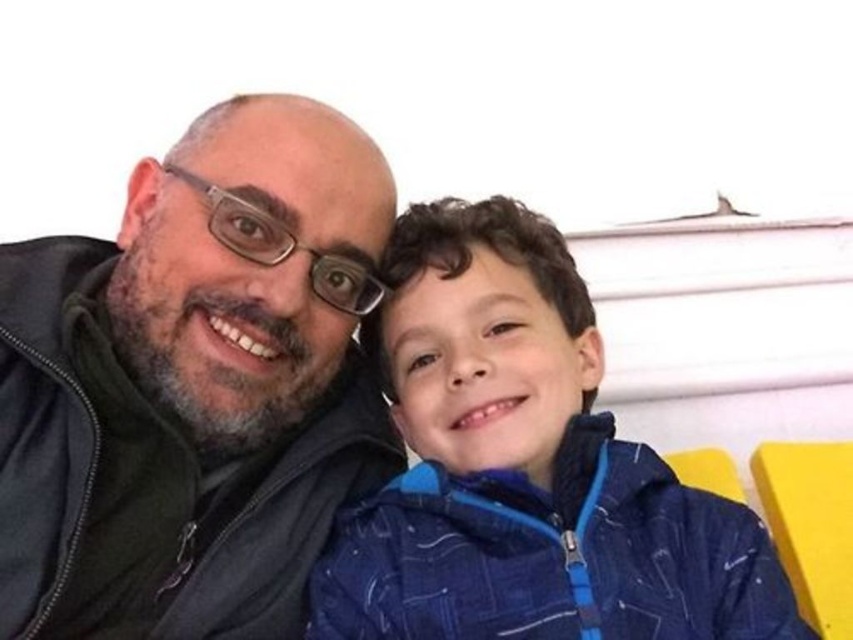
Which is in front, point (323, 141) or point (544, 356)?

Point (544, 356) is more forward.

This screenshot has width=853, height=640. In order to click on matte black jacket at left in this screenshot , I will do `click(193, 385)`.